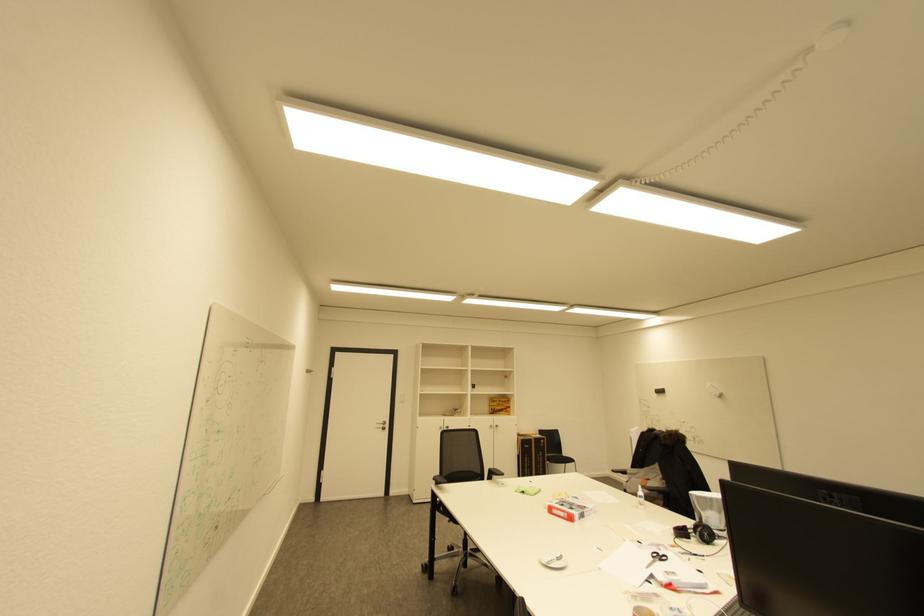
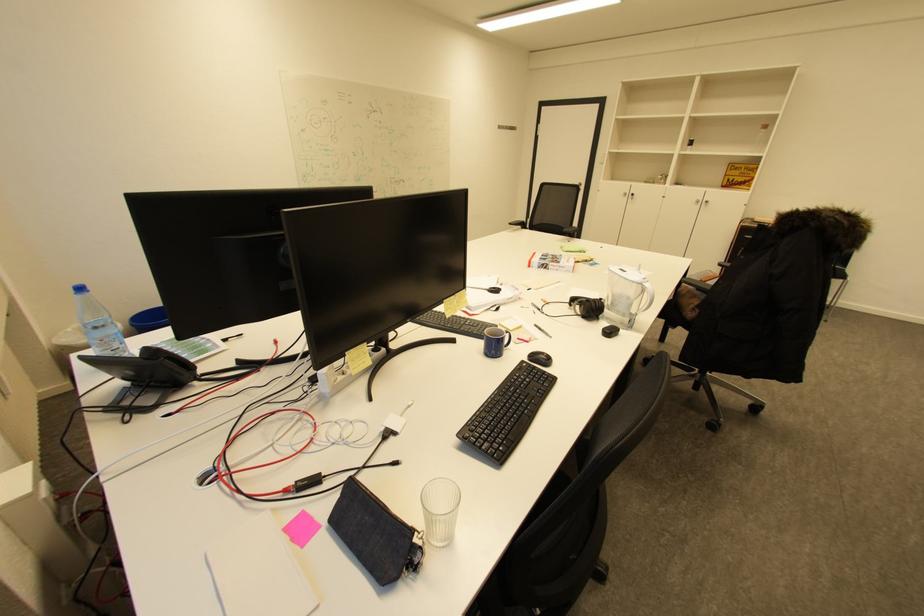
Find the pixel in the second image that matches point (496, 427) in the first image.

(703, 201)